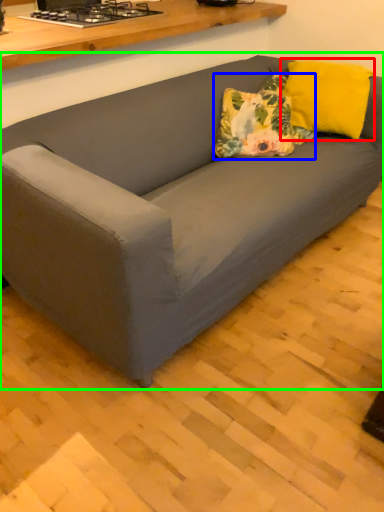
Question: Considering the real-world distances, which object is farthest from pillow (highlighted by a red box)? throw pillow (highlighted by a blue box) or studio couch (highlighted by a green box)?

Choices:
 (A) throw pillow
 (B) studio couch

Answer: (B)